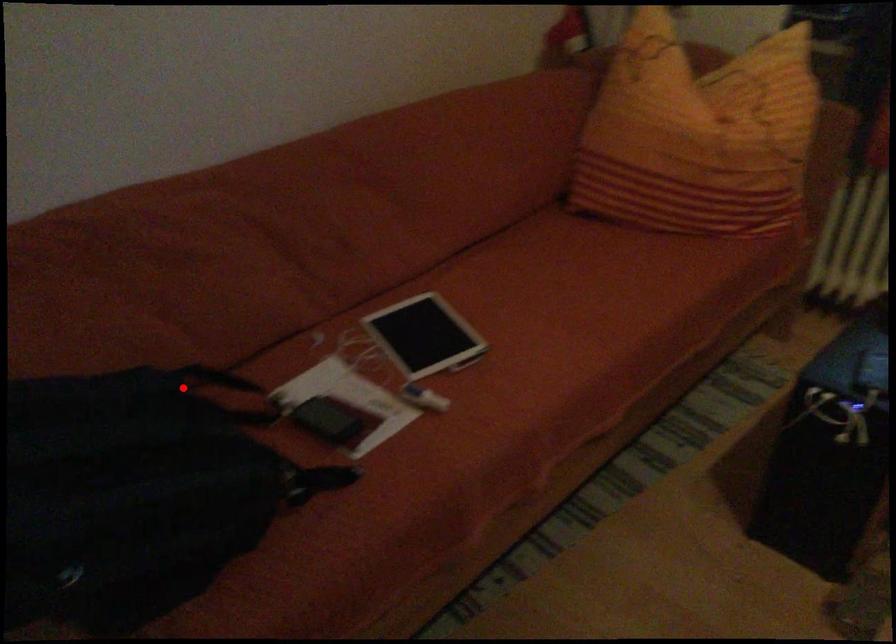
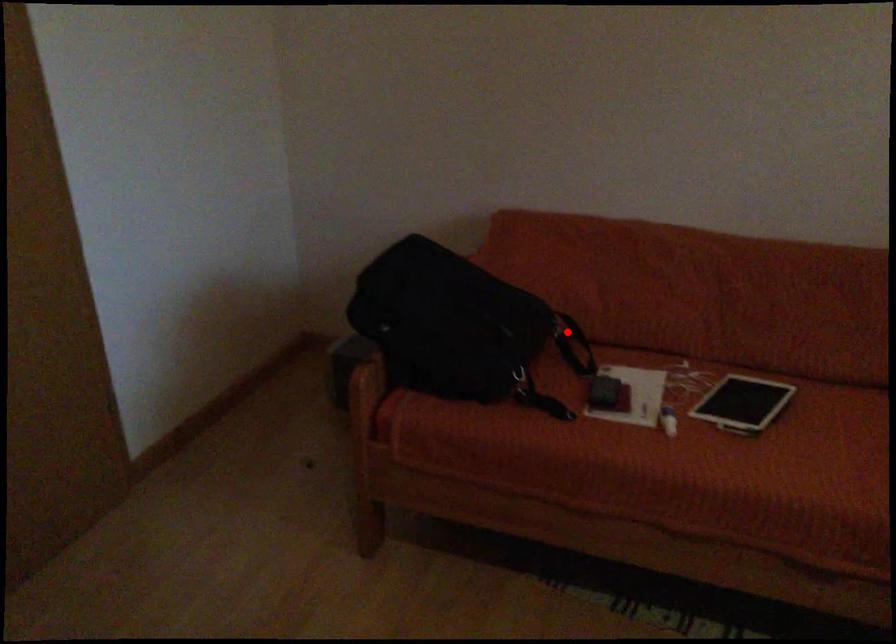
I am providing you with two images of the same scene from different viewpoints. A red point is marked on the first image and another point is marked on the second image. Is the marked point in image1 the same physical position as the marked point in image2?

Yes